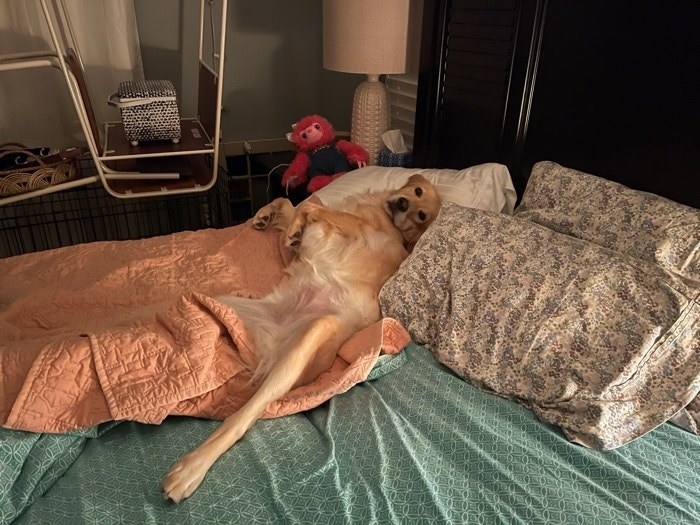
In order to click on pink stuffed animal in this screenshot , I will do `click(351, 149)`.